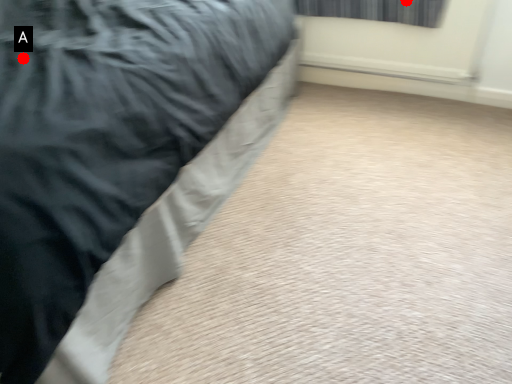
Question: Two points are circled on the image, labeled by A and B beside each circle. Which point is closer to the camera?

Choices:
 (A) A is closer
 (B) B is closer

Answer: (A)